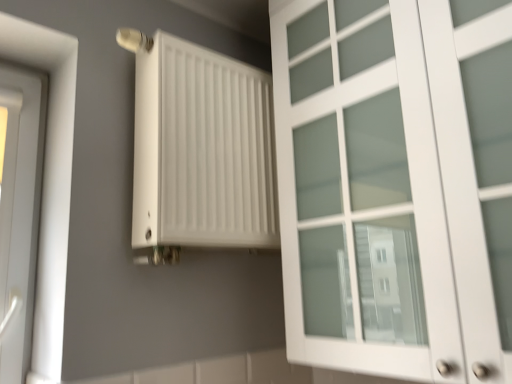
Locate an element on the screen. white matte radiator at upper left is located at coordinates (201, 151).

Measure the distance between white matte radiator at upper left and camera.

white matte radiator at upper left and camera are 3.62 feet apart from each other.

The height and width of the screenshot is (384, 512). What do you see at coordinates (201, 151) in the screenshot?
I see `white matte radiator at upper left` at bounding box center [201, 151].

Image resolution: width=512 pixels, height=384 pixels. What do you see at coordinates (396, 185) in the screenshot?
I see `white matte cabinet at right` at bounding box center [396, 185].

Where is `white matte cabinet at right`? The height and width of the screenshot is (384, 512). white matte cabinet at right is located at coordinates (396, 185).

Where is `white matte radiator at upper left`? white matte radiator at upper left is located at coordinates (201, 151).

Does white matte cabinet at right appear on the right side of white matte radiator at upper left?

Indeed, white matte cabinet at right is positioned on the right side of white matte radiator at upper left.

Relative to white matte radiator at upper left, is white matte cabinet at right in front or behind?

Clearly, white matte cabinet at right is in front of white matte radiator at upper left.

Is point (434, 193) positioned after point (163, 227)?

No.

From the image's perspective, between white matte cabinet at right and white matte radiator at upper left, which one is located above?

white matte cabinet at right, from the image's perspective.

From a real-world perspective, does white matte cabinet at right sit lower than white matte radiator at upper left?

Yes, from a real-world perspective, white matte cabinet at right is beneath white matte radiator at upper left.

Does white matte cabinet at right have a greater width compared to white matte radiator at upper left?

Correct, the width of white matte cabinet at right exceeds that of white matte radiator at upper left.

Is white matte cabinet at right taller or shorter than white matte radiator at upper left?

white matte cabinet at right is taller than white matte radiator at upper left.

Considering the sizes of objects white matte cabinet at right and white matte radiator at upper left in the image provided, who is bigger, white matte cabinet at right or white matte radiator at upper left?

Bigger between the two is white matte cabinet at right.

Looking at this image, can white matte radiator at upper left be found inside white matte cabinet at right?

That's incorrect, white matte radiator at upper left is not inside white matte cabinet at right.

Does white matte cabinet at right touch white matte radiator at upper left?

No, white matte cabinet at right is not with white matte radiator at upper left.

Could you tell me if white matte cabinet at right is turned towards white matte radiator at upper left?

No.

Can you tell me how much white matte cabinet at right and white matte radiator at upper left differ in facing direction?

88.3 degrees separate the facing orientations of white matte cabinet at right and white matte radiator at upper left.

I want to click on cupboard on the right of white matte radiator at upper left, so click(396, 185).

Would you say white matte radiator at upper left is to the left or to the right of white matte cabinet at right in the picture?

Clearly, white matte radiator at upper left is on the left of white matte cabinet at right in the image.

In the scene shown: In the image, is white matte radiator at upper left positioned in front of or behind white matte cabinet at right?

white matte radiator at upper left is positioned farther from the viewer than white matte cabinet at right.

Which point is more forward, (205, 148) or (418, 362)?

The point (418, 362) is closer to the camera.

From the image's perspective, which one is positioned higher, white matte radiator at upper left or white matte cabinet at right?

white matte cabinet at right appears higher in the image.

From a real-world perspective, between white matte radiator at upper left and white matte cabinet at right, who is vertically lower?

In real-world perspective, white matte cabinet at right is lower.

Is white matte radiator at upper left thinner than white matte cabinet at right?

Yes.

Can you confirm if white matte radiator at upper left is shorter than white matte cabinet at right?

Indeed, white matte radiator at upper left has a lesser height compared to white matte cabinet at right.

Who is smaller, white matte radiator at upper left or white matte cabinet at right?

Smaller between the two is white matte radiator at upper left.

Is white matte radiator at upper left inside the boundaries of white matte cabinet at right, or outside?

white matte radiator at upper left is not enclosed by white matte cabinet at right.

Are white matte radiator at upper left and white matte cabinet at right making contact?

white matte radiator at upper left and white matte cabinet at right are clearly separated.

Is white matte radiator at upper left turned away from white matte cabinet at right?

No, white matte radiator at upper left is not facing the opposite direction of white matte cabinet at right.

Can you tell me how much white matte radiator at upper left and white matte cabinet at right differ in facing direction?

They differ by 88.3 degrees in their facing directions.

Find the location of a particular element. The image size is (512, 384). cupboard that appears in front of the white matte radiator at upper left is located at coordinates (396, 185).

Locate an element on the screen. The height and width of the screenshot is (384, 512). cupboard that is under the white matte radiator at upper left (from a real-world perspective) is located at coordinates (396, 185).

This screenshot has height=384, width=512. I want to click on radiator behind the white matte cabinet at right, so click(201, 151).